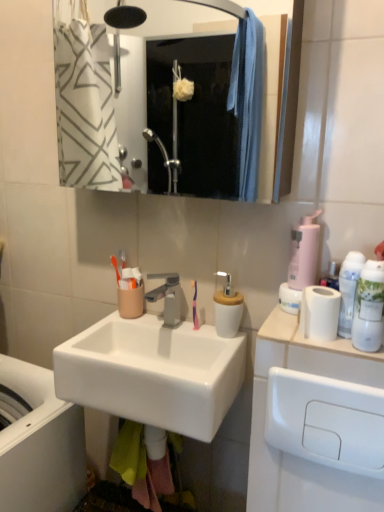
This screenshot has width=384, height=512. I want to click on vacant area that is in front of purple plastic toothbrush at center, so click(x=203, y=340).